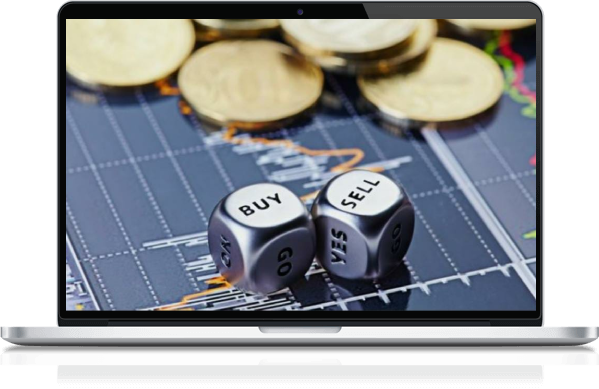
Where is `device screen`? device screen is located at coordinates (142, 8).